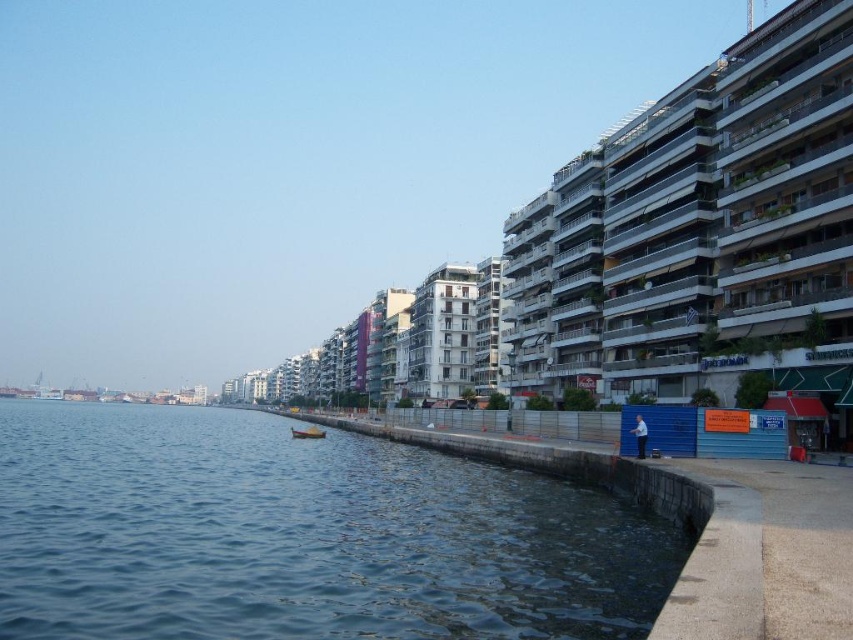
In the scene shown: Can you confirm if blue water at lower left is positioned to the right of wooden boat at lower left?

No, blue water at lower left is not to the right of wooden boat at lower left.

At what (x,y) coordinates should I click in order to perform the action: click on blue water at lower left. Please return your answer as a coordinate pair (x, y). This screenshot has width=853, height=640. Looking at the image, I should click on (300, 536).

Is point (15, 412) in front of point (302, 438)?

No, it is not.

Find the location of a particular element. blue water at lower left is located at coordinates (300, 536).